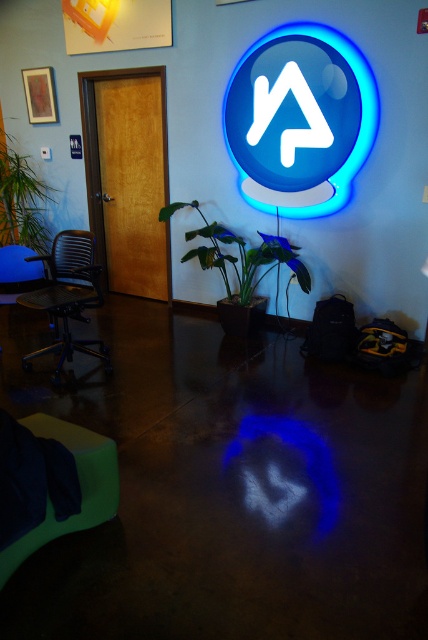
Question: Considering the relative positions of blue glass neon sign at upper center and green fabric swivel chair at lower left in the image provided, where is blue glass neon sign at upper center located with respect to green fabric swivel chair at lower left?

Choices:
 (A) right
 (B) left

Answer: (A)

Question: Which of the following is the farthest from the observer?

Choices:
 (A) green leafy plant at left
 (B) blue glass neon sign at upper center
 (C) green fabric swivel chair at lower left

Answer: (A)

Question: Is metallic mesh office chair at left below green leafy plant at left?

Choices:
 (A) no
 (B) yes

Answer: (B)

Question: Among these points, which one is nearest to the camera?

Choices:
 (A) (62, 520)
 (B) (38, 200)
 (C) (86, 284)

Answer: (A)

Question: Is blue glass neon sign at upper center bigger than green leafy plant at left?

Choices:
 (A) yes
 (B) no

Answer: (A)

Question: Which point is closer to the camera taking this photo?

Choices:
 (A) (261, 134)
 (B) (42, 541)
 (C) (80, 273)

Answer: (B)